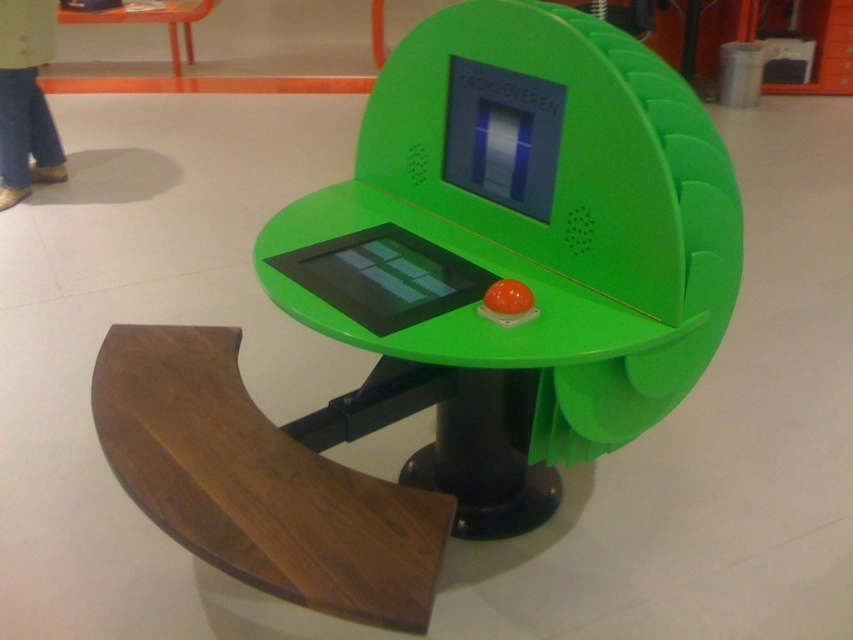
Does point (321, 564) come behind point (134, 17)?

No, (321, 564) is closer to viewer.

Can you confirm if walnut wood armrest at lower left is shorter than orange glossy table at upper left?

Indeed, walnut wood armrest at lower left has a lesser height compared to orange glossy table at upper left.

This screenshot has height=640, width=853. I want to click on walnut wood armrest at lower left, so click(259, 483).